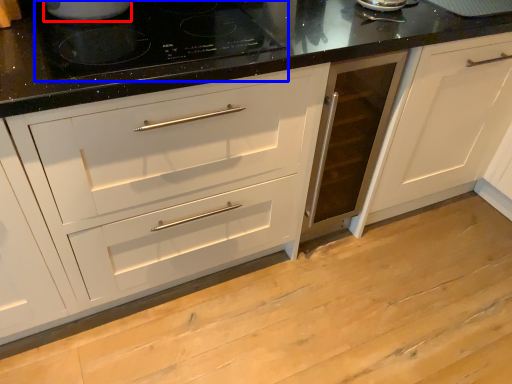
Question: Which point is further to the camera, appliance (highlighted by a red box) or gas stove (highlighted by a blue box)?

Choices:
 (A) appliance
 (B) gas stove

Answer: (A)